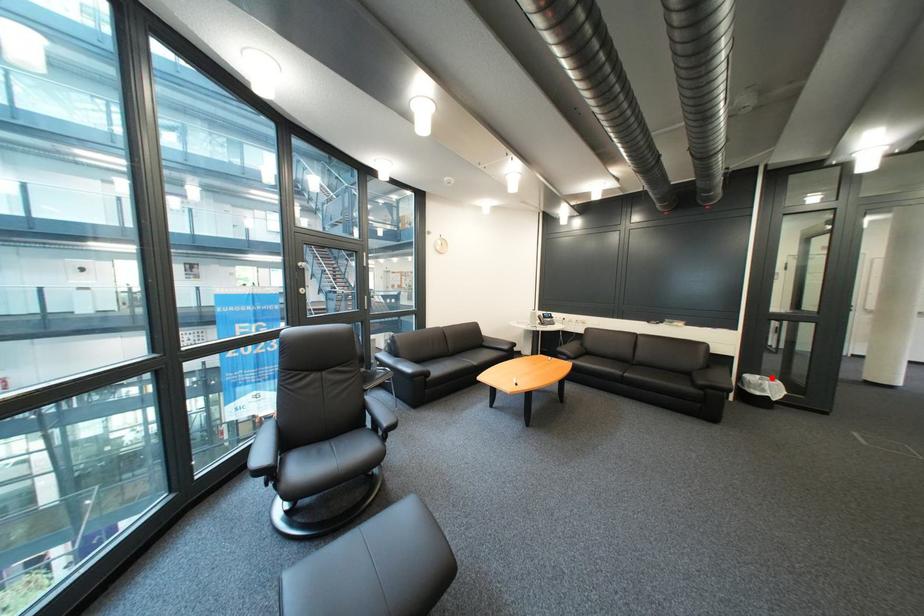
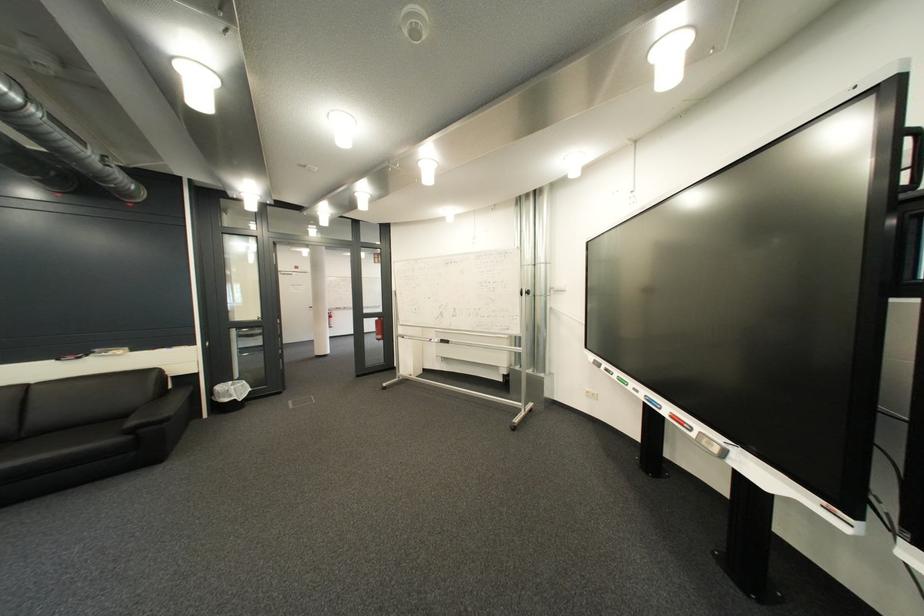
Question: I am providing you with two images of the same scene from different viewpoints. In image1, a red point is highlighted. Considering the same 3D point in image2, which of the following is correct?

Choices:
 (A) It is closer
 (B) It is farther

Answer: (A)